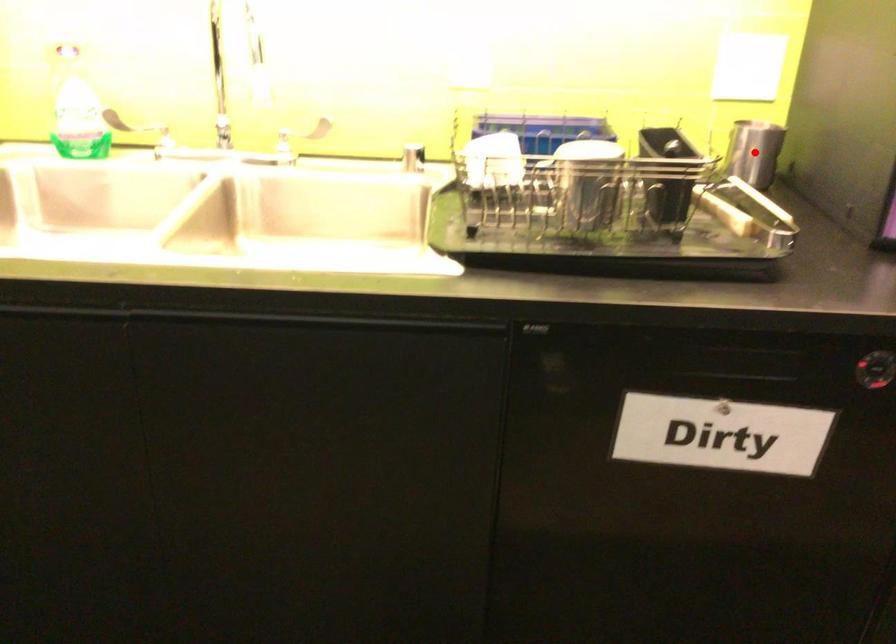
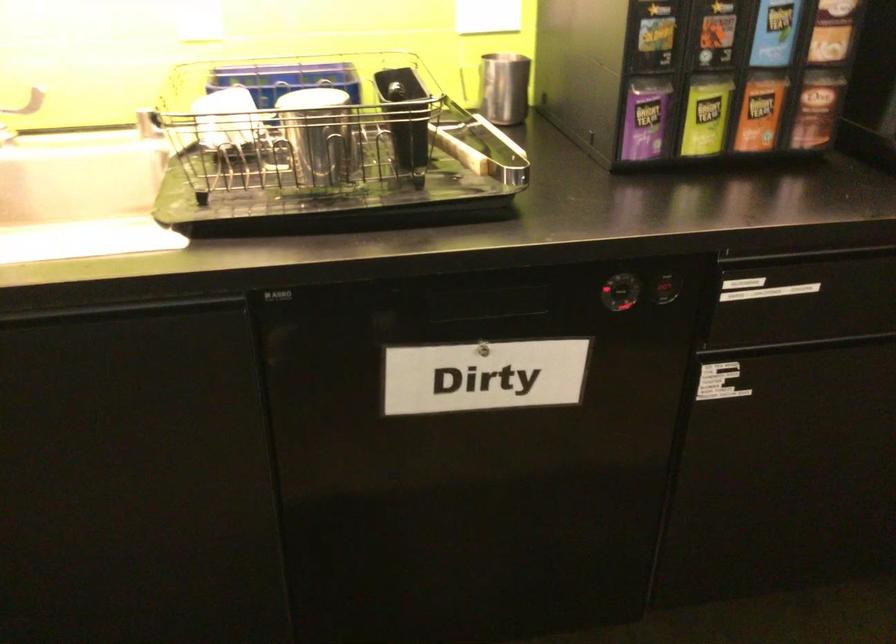
The point at the highlighted location is marked in the first image. Where is the corresponding point in the second image?

(504, 88)